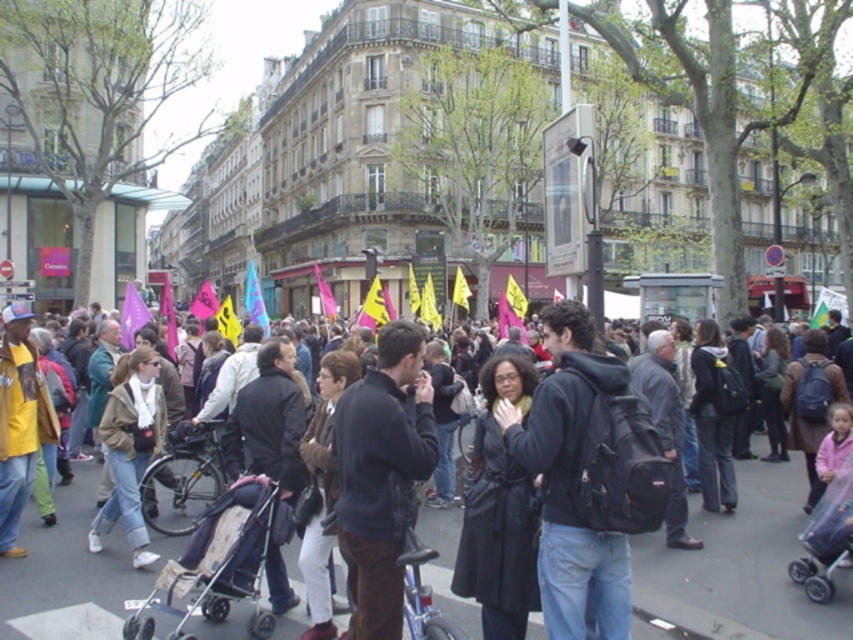
You are a delivery person trying to place your black backpack at center on the dark gray asphalt at center. Can you fit the backpack entirely on the asphalt without any part hanging off?

The dark gray asphalt at center has a larger size compared to black backpack at center, so yes, the backpack can be placed entirely on the asphalt without any part hanging off.

You are standing at the corner of the street and want to walk to the dark gray asphalt at center. According to the coordinates provided, in which direction should you move relative to your current position?

The dark gray asphalt at center is located at coordinates point (x=741, y=564), so you should move towards the center of the image to reach it.

You are a delivery person who needs to place a package at the exact coordinates given in the scene description. The package must be placed at the same position as the black backpack at center. Where should you place the package?

The package should be placed at the coordinates point (570, 483), which is the location of the black backpack at center.